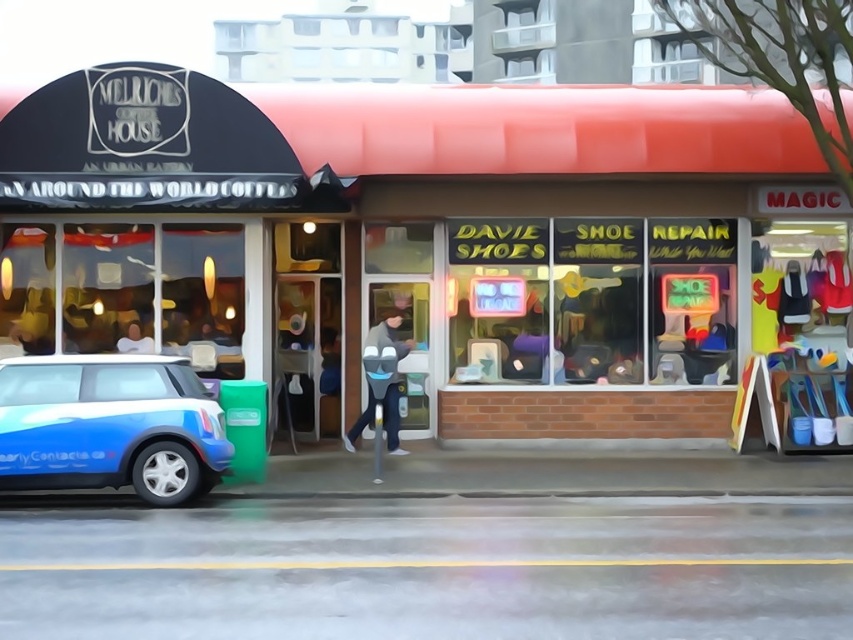
Is brick storefront at center wider than blue matte toy car at lower left?

Indeed, brick storefront at center has a greater width compared to blue matte toy car at lower left.

Which is in front, point (612, 144) or point (196, 380)?

Point (196, 380) is more forward.

At what (x,y) coordinates should I click in order to perform the action: click on brick storefront at center. Please return your answer as a coordinate pair (x, y). Looking at the image, I should click on (456, 252).

Find the location of a particular element. This screenshot has height=640, width=853. brick storefront at center is located at coordinates (456, 252).

Who is more distant from viewer, [67,385] or [137,344]?

Positioned behind is point [137,344].

Where is `blue matte toy car at lower left`? This screenshot has width=853, height=640. blue matte toy car at lower left is located at coordinates (109, 426).

Consider the image. Is blue matte toy car at lower left to the right of gray fabric jacket at center from the viewer's perspective?

Incorrect, blue matte toy car at lower left is not on the right side of gray fabric jacket at center.

The height and width of the screenshot is (640, 853). In order to click on blue matte toy car at lower left in this screenshot , I will do `click(109, 426)`.

At what (x,y) coordinates should I click in order to perform the action: click on blue matte toy car at lower left. Please return your answer as a coordinate pair (x, y). This screenshot has height=640, width=853. Looking at the image, I should click on (109, 426).